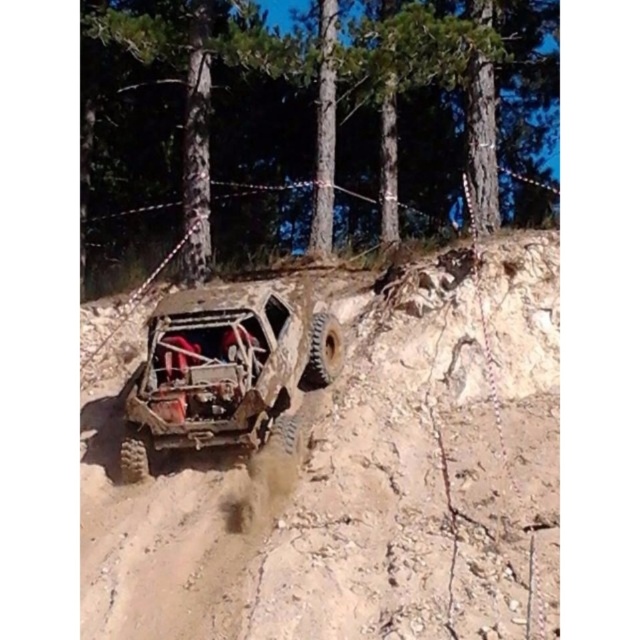
What is the 2D coordinate of the dusty brown terrain at center?

The 2D coordinate of the dusty brown terrain at center is at point [352,481].

You are a hiker trying to cross the muddy terrain in the forest. There is a point marked at coordinates (352, 481) which is the dusty brown terrain at center. Can you safely walk on this terrain without sinking?

The point marked at coordinates (352, 481) indicates dusty brown terrain at center, which is the same as the muddy trail where the offroad vehicle is driving. Since the vehicle is able to navigate it, it suggests the terrain is firm enough to support weight, so you can walk there without sinking.